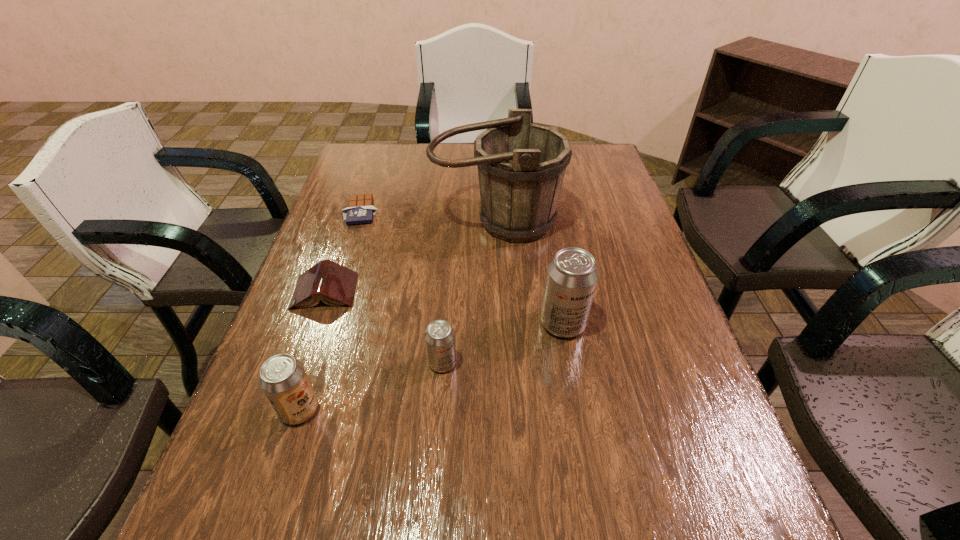
Where is `the fourth shortest object`? the fourth shortest object is located at coordinates (283, 379).

I want to click on the leftmost beer can, so (283, 379).

Image resolution: width=960 pixels, height=540 pixels. Find the location of `the fifth farthest object`. the fifth farthest object is located at coordinates (439, 336).

At what (x,y) coordinates should I click in order to perform the action: click on the third shortest object. Please return your answer as a coordinate pair (x, y). This screenshot has height=540, width=960. Looking at the image, I should click on (439, 336).

What are the coordinates of `the rightmost beer can` in the screenshot? It's located at (572, 275).

Where is `the tallest beer can`? This screenshot has height=540, width=960. the tallest beer can is located at coordinates (572, 275).

Identify the location of the shortest object. (360, 210).

Where is `the tallest object`? The image size is (960, 540). the tallest object is located at coordinates (521, 166).

At what (x,y) coordinates should I click in order to perform the action: click on book. Please return your answer as a coordinate pair (x, y). This screenshot has height=540, width=960. Looking at the image, I should click on (334, 284).

The height and width of the screenshot is (540, 960). In order to click on vacant space located 0.070m on the left of the second tallest beer can in this screenshot , I will do (245, 409).